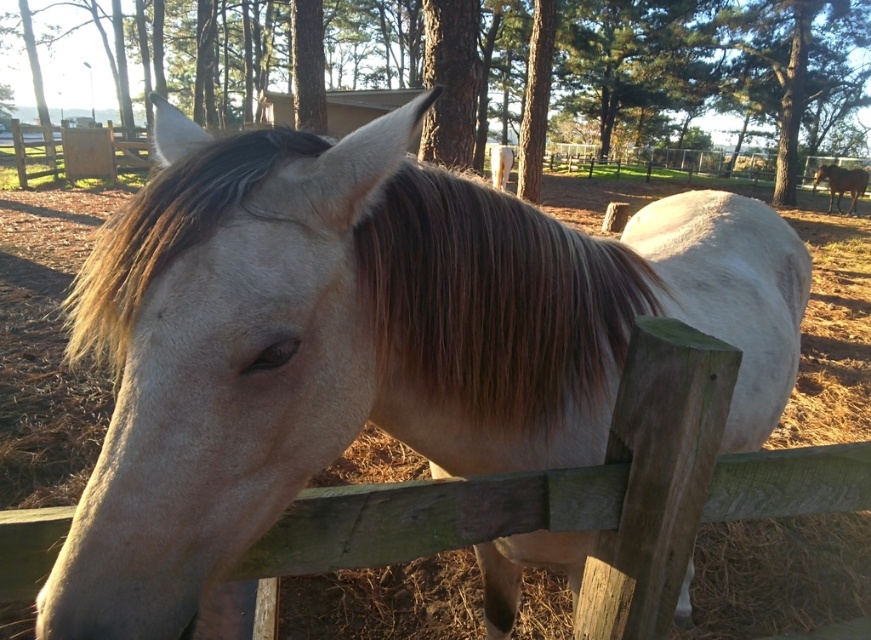
You are a photographer trying to capture the brown silky mane at center and the brown glossy horse at upper right in a single frame. Based on their heights, which one should you focus on first to ensure both are in the shot?

The brown silky mane at center is taller than the brown glossy horse at upper right, so you should focus on the brown silky mane at center first to ensure both are in the shot.

You are a photographer standing in front of the scene. You want to capture a photo where the brown glossy horse at upper right is in focus while the brown silky mane at center is slightly out of focus. Based on their positions, is this possible?

The brown silky mane at center is located below the brown glossy horse at upper right, so adjusting the camera focus on the brown glossy horse at upper right could keep it sharp while the lower positioned brown silky mane at center might naturally be out of focus depending on depth of field.